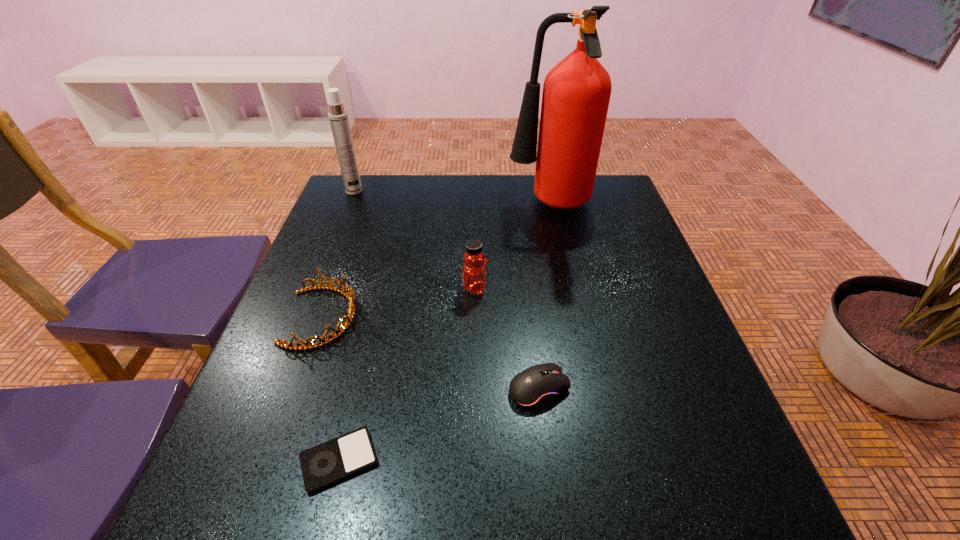
At what (x,y) coordinates should I click in order to perform the action: click on the tallest object. Please return your answer as a coordinate pair (x, y). The image size is (960, 540). Looking at the image, I should click on [x=576, y=93].

What are the coordinates of `aerosol can` in the screenshot? It's located at (338, 117).

Locate an element on the screen. The image size is (960, 540). honey is located at coordinates (474, 273).

In order to click on the fourth object from left to right in this screenshot , I will do `click(474, 273)`.

Where is `the fourth tallest object`? the fourth tallest object is located at coordinates (350, 296).

The width and height of the screenshot is (960, 540). In order to click on computer mouse in this screenshot , I will do `click(535, 387)`.

The image size is (960, 540). I want to click on the fifth tallest object, so click(535, 387).

Locate an element on the screen. the nearest object is located at coordinates (332, 461).

Where is `the shortest object`? the shortest object is located at coordinates (332, 461).

Locate an element on the screen. The width and height of the screenshot is (960, 540). blank area located 0.170m at the nozzle of the fire extinguisher is located at coordinates (449, 206).